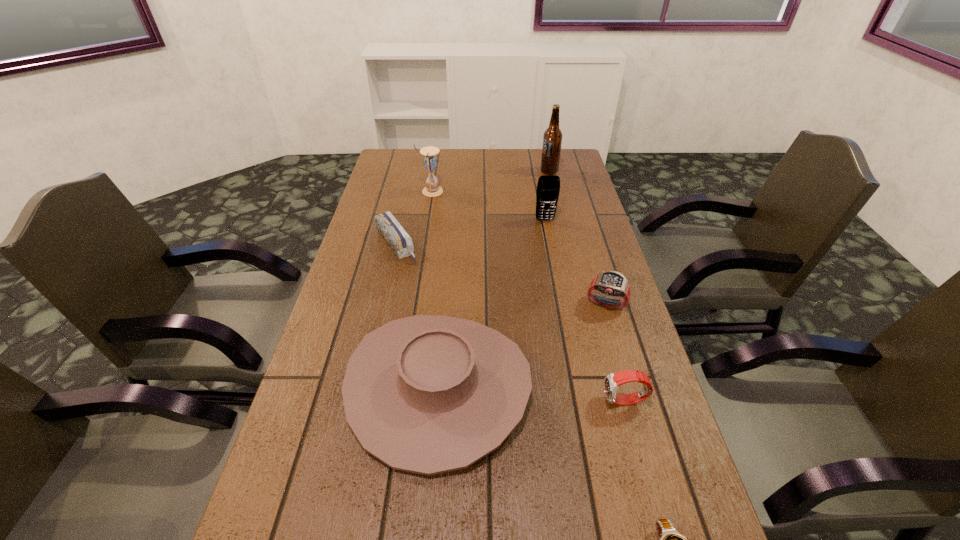
The width and height of the screenshot is (960, 540). In the image, there is a desktop. In order to click on blank space at the far left corner in this screenshot , I will do `click(416, 168)`.

In order to click on free space that is in between the farthest watch and the cowboy hat in this screenshot , I will do `click(522, 345)`.

At what (x,y) coordinates should I click in order to perform the action: click on vacant area between the sixth nearest object and the seventh nearest object. Please return your answer as a coordinate pair (x, y). The height and width of the screenshot is (540, 960). Looking at the image, I should click on (488, 206).

At what (x,y) coordinates should I click in order to perform the action: click on vacant space in between the seventh nearest object and the second shortest object. Please return your answer as a coordinate pair (x, y). The image size is (960, 540). Looking at the image, I should click on (413, 218).

In order to click on vacant space that is in between the second farthest watch and the cowboy hat in this screenshot , I will do `click(532, 394)`.

This screenshot has height=540, width=960. Find the location of `free space between the cellular telephone and the second farthest watch`. free space between the cellular telephone and the second farthest watch is located at coordinates (585, 310).

Find the location of a particular element. vacant area that lies between the fourth nearest object and the second shortest object is located at coordinates (501, 274).

Identify the location of free spot between the seventh nearest object and the fourth nearest object. (518, 247).

You are a GUI agent. You are given a task and a screenshot of the screen. Output one action in this format:
    pyautogui.click(x=<x>, y=<y>)
    Task: Click on the blank region between the second farthest object and the second nearest watch
    The width and height of the screenshot is (960, 540).
    Given the screenshot: What is the action you would take?
    pyautogui.click(x=528, y=296)

This screenshot has width=960, height=540. I want to click on object that stands as the third closest to the farthest watch, so click(548, 188).